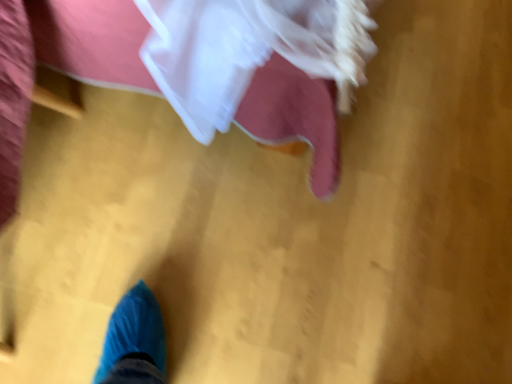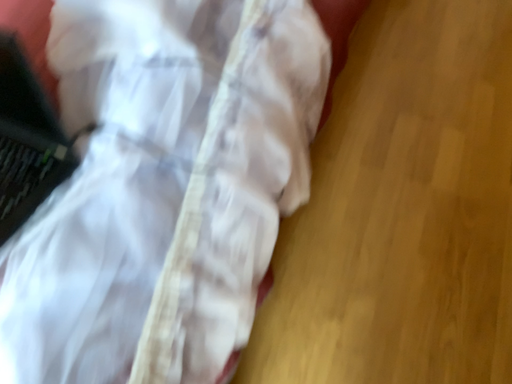
Question: How did the camera likely rotate when shooting the video?

Choices:
 (A) rotated upward
 (B) rotated downward

Answer: (A)